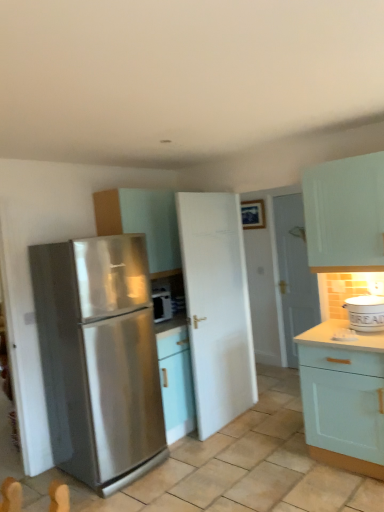
Identify the location of vacant space in front of white ceramic bucket at right, which is the first appliance from front to back. This screenshot has width=384, height=512. (365, 338).